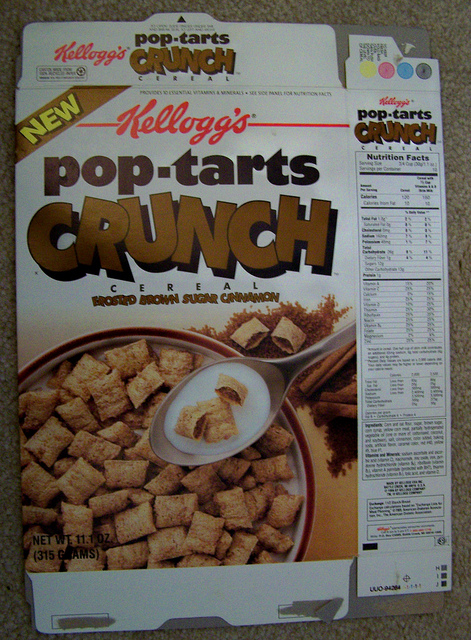
Where is `spoon`? This screenshot has width=471, height=640. spoon is located at coordinates (294, 363).